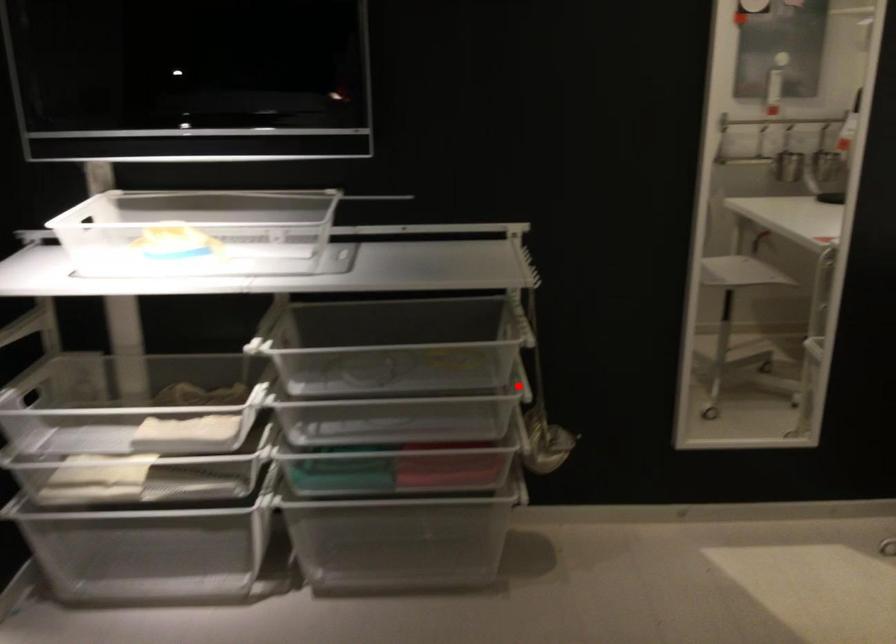
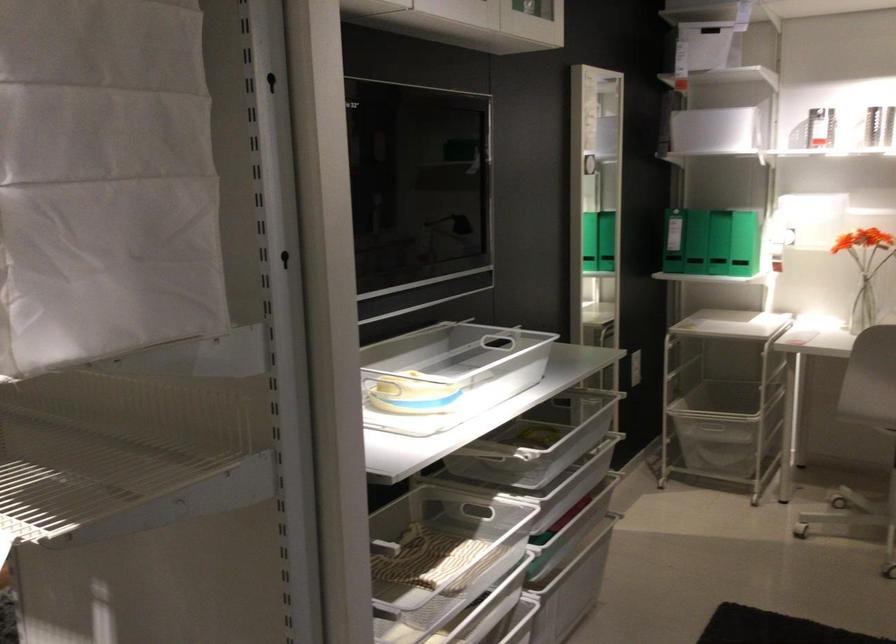
Where in the second image is the point corresponding to the highlighted location from the first image?

(561, 428)